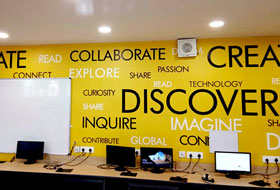
The width and height of the screenshot is (280, 190). What are the coordinates of `bold black text on wall` in the screenshot? It's located at (191, 107).